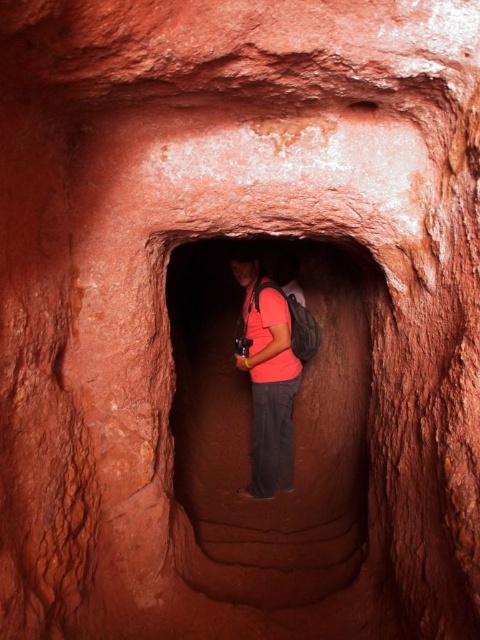
Is point (326, 269) farther from camera compared to point (250, 317)?

Yes, it is.

Identify the location of matte red rock at center. Image resolution: width=480 pixels, height=640 pixels. (251, 426).